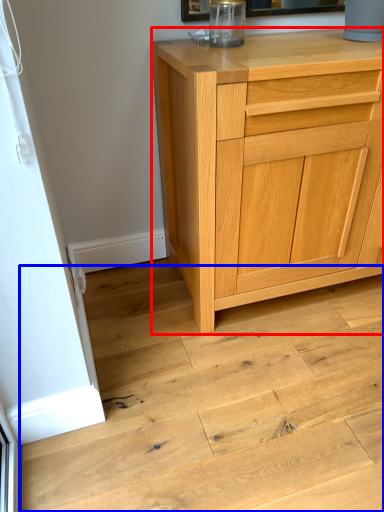
Question: Which of the following is the farthest to the observer, chest of drawers (highlighted by a red box) or stair (highlighted by a blue box)?

Choices:
 (A) chest of drawers
 (B) stair

Answer: (A)